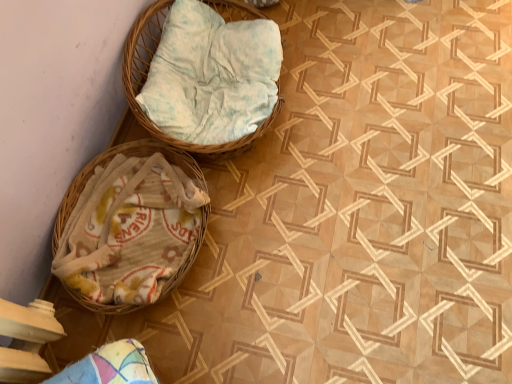
Identify the location of empty space that is to the right of woven wicker basket at upper center, marked as the 2th basket in a bottom-to-top arrangement. (362, 105).